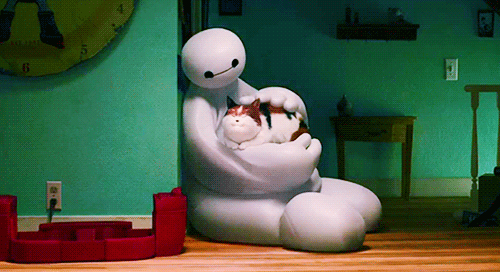
Locate an element on the screen. clock is located at coordinates (66, 27).